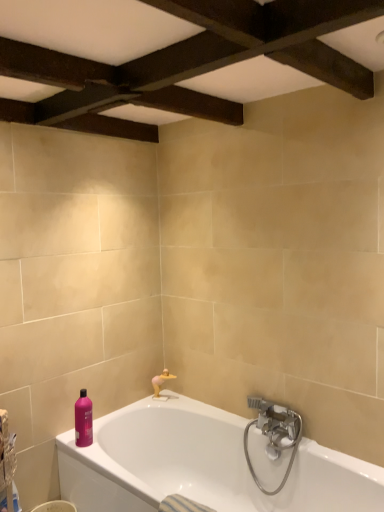
You are a GUI agent. You are given a task and a screenshot of the screen. Output one action in this format:
    pyautogui.click(x=<x>, y=<y>)
    Task: Click on the free spot to the left of matte gold faucet at lower center
    The width and height of the screenshot is (384, 512).
    Given the screenshot: What is the action you would take?
    pyautogui.click(x=148, y=401)